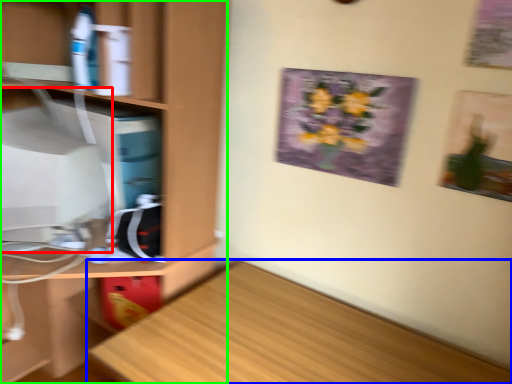
Question: Based on their relative distances, which object is farther from computer monitor (highlighted by a red box)? Choose from desk (highlighted by a blue box) and cabinetry (highlighted by a green box).

Choices:
 (A) desk
 (B) cabinetry

Answer: (A)